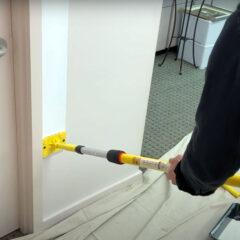
Find the location of a particular element. The width and height of the screenshot is (240, 240). white paint is located at coordinates (56, 89).